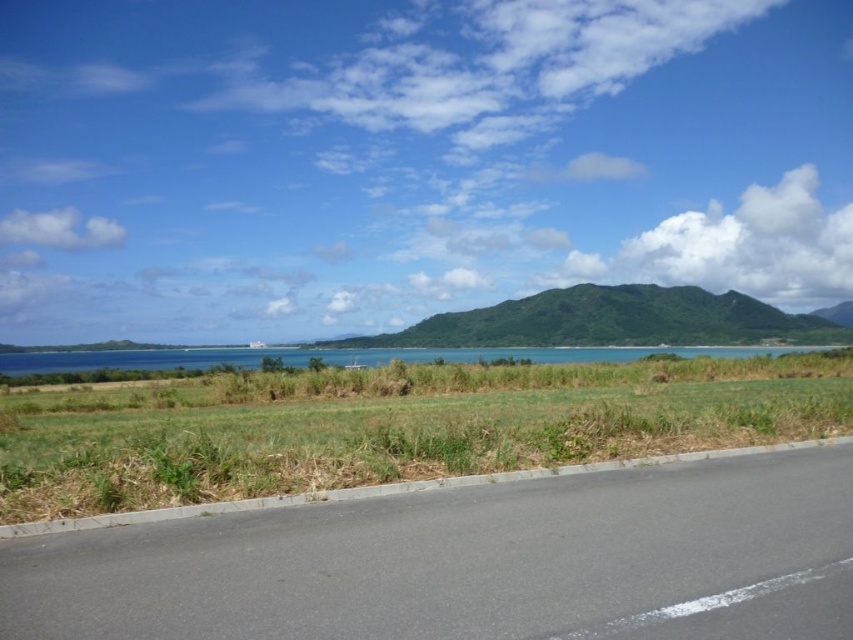
Which is more to the left, green textured mountain at center or blue water at center?

blue water at center

Describe the element at coordinates (612, 321) in the screenshot. I see `green textured mountain at center` at that location.

Is point (792, 330) positioned after point (187, 353)?

No, (792, 330) is in front of (187, 353).

Image resolution: width=853 pixels, height=640 pixels. In order to click on green textured mountain at center in this screenshot , I will do `click(612, 321)`.

Does black asphalt highway at lower center have a larger size compared to blue water at center?

Incorrect, black asphalt highway at lower center is not larger than blue water at center.

Can you confirm if black asphalt highway at lower center is positioned above blue water at center?

Indeed, black asphalt highway at lower center is positioned over blue water at center.

Where is `black asphalt highway at lower center`? This screenshot has width=853, height=640. black asphalt highway at lower center is located at coordinates (469, 563).

Does black asphalt highway at lower center have a lesser width compared to green textured mountain at center?

Yes, black asphalt highway at lower center is thinner than green textured mountain at center.

Is black asphalt highway at lower center above green textured mountain at center?

Incorrect, black asphalt highway at lower center is not positioned above green textured mountain at center.

Who is more forward, (410, 497) or (683, 314)?

Point (410, 497)

Identify the location of black asphalt highway at lower center. The width and height of the screenshot is (853, 640). (469, 563).